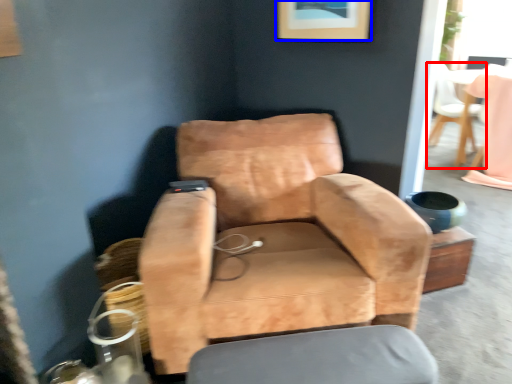
Question: Which object appears farthest to the camera in this image, chair (highlighted by a red box) or picture frame (highlighted by a blue box)?

Choices:
 (A) chair
 (B) picture frame

Answer: (A)